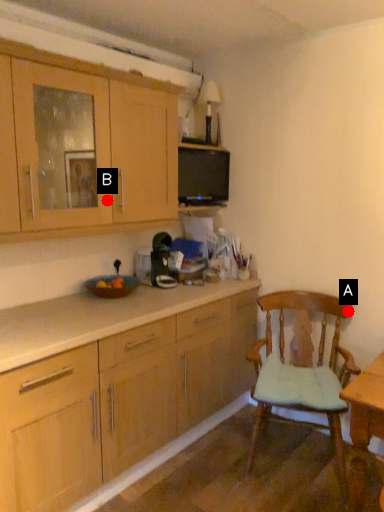
Question: Two points are circled on the image, labeled by A and B beside each circle. Which point appears closest to the camera in this image?

Choices:
 (A) A is closer
 (B) B is closer

Answer: (B)